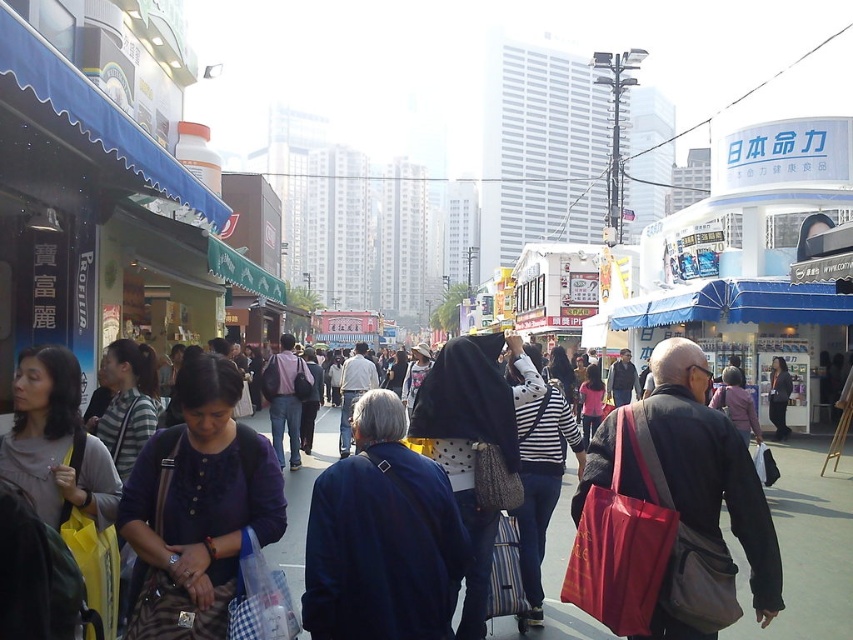
Does matte black jacket at center appear under red fabric bag at center?

Correct, matte black jacket at center is located below red fabric bag at center.

Who is more forward, (225,394) or (759,545)?

Point (759,545) is in front.

You are a GUI agent. You are given a task and a screenshot of the screen. Output one action in this format:
    pyautogui.click(x=<x>, y=<y>)
    Task: Click on the matte black jacket at center
    The width and height of the screenshot is (853, 640).
    Given the screenshot: What is the action you would take?
    pyautogui.click(x=392, y=538)

Looking at this image, how much distance is there between dark blue jacket at center and red fabric bag at center?

The distance of dark blue jacket at center from red fabric bag at center is 5.44 meters.

Which is behind, point (317, 524) or point (691, 502)?

Positioned behind is point (317, 524).

Locate an element on the screen. This screenshot has height=640, width=853. dark blue jacket at center is located at coordinates (x=381, y=536).

Does matte blue shirt at center appear on the right side of red fabric bag at center?

Incorrect, matte blue shirt at center is not on the right side of red fabric bag at center.

Does matte blue shirt at center have a greater width compared to red fabric bag at center?

Correct, the width of matte blue shirt at center exceeds that of red fabric bag at center.

Identify the location of matte blue shirt at center. (196, 508).